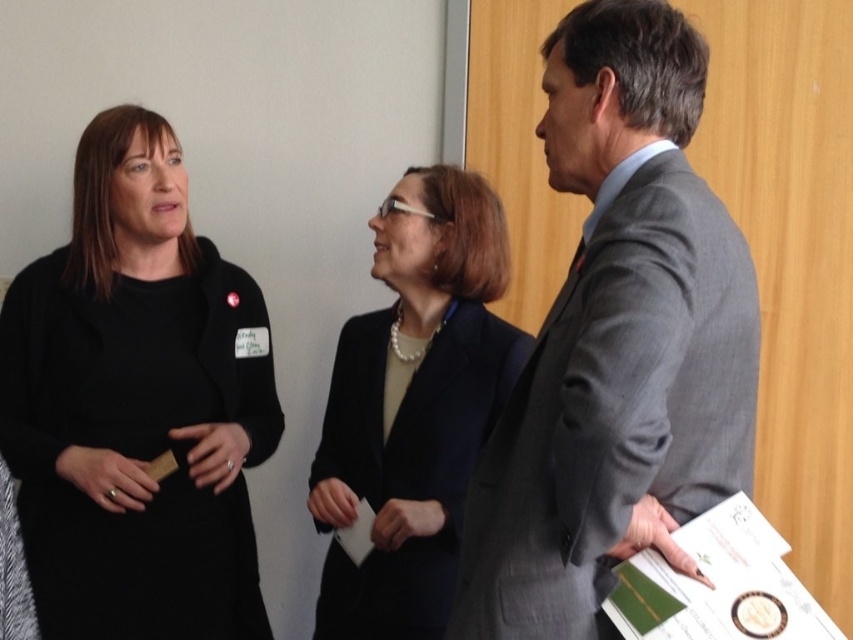
Question: Observing the image, what is the correct spatial positioning of black matte dress at left in reference to matte black blazer at center?

Choices:
 (A) below
 (B) above

Answer: (B)

Question: Which object is positioned farthest from the black matte dress at left?

Choices:
 (A) gray suit at center
 (B) matte black blazer at center

Answer: (A)

Question: Can you confirm if black matte dress at left is positioned to the right of matte black blazer at center?

Choices:
 (A) yes
 (B) no

Answer: (B)

Question: Which is nearer to the black matte dress at left?

Choices:
 (A) gray suit at center
 (B) matte black blazer at center

Answer: (B)

Question: Which object appears farthest from the camera in this image?

Choices:
 (A) gray suit at center
 (B) black matte dress at left

Answer: (B)

Question: Considering the relative positions of gray suit at center and black matte dress at left in the image provided, where is gray suit at center located with respect to black matte dress at left?

Choices:
 (A) above
 (B) below

Answer: (A)